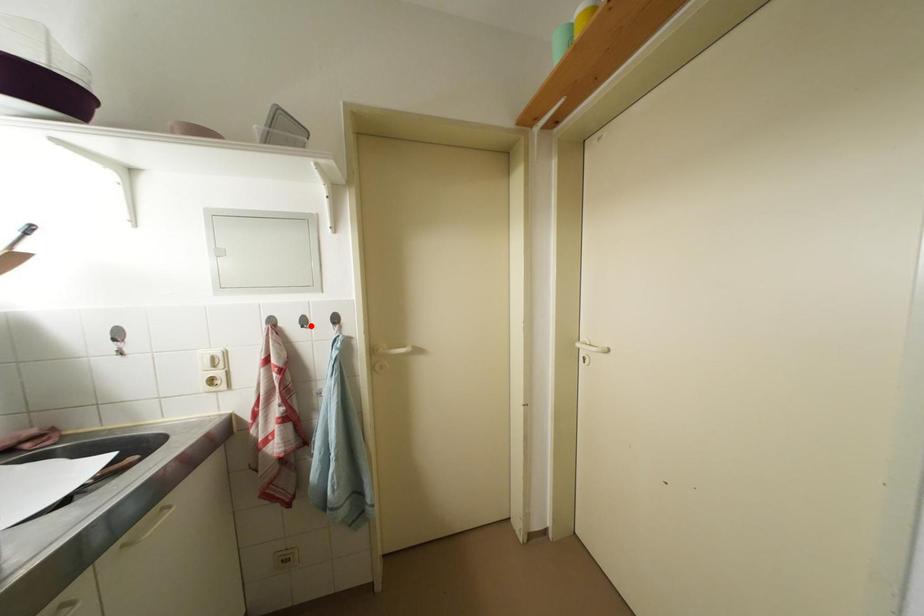
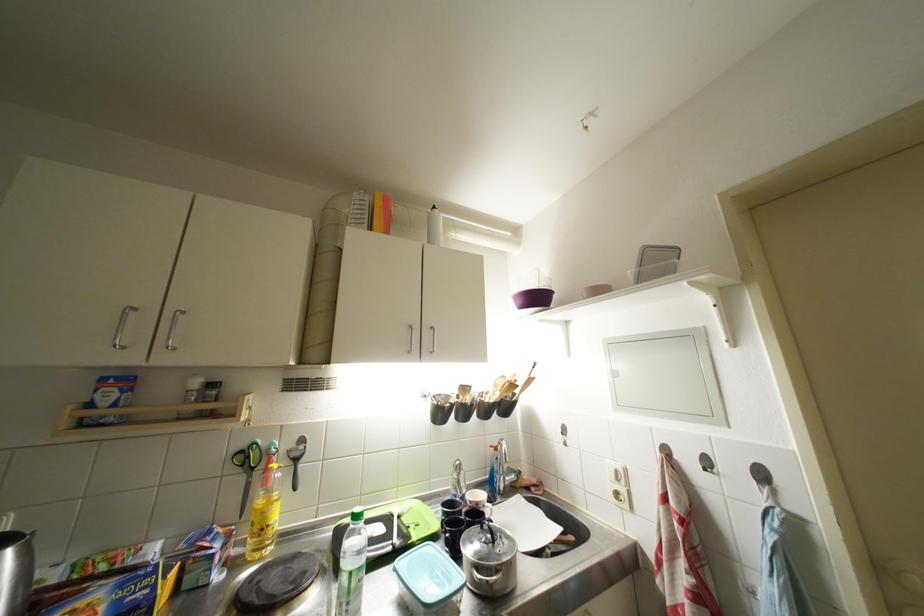
The point at the highlighted location is marked in the first image. Where is the corresponding point in the second image?

(714, 467)